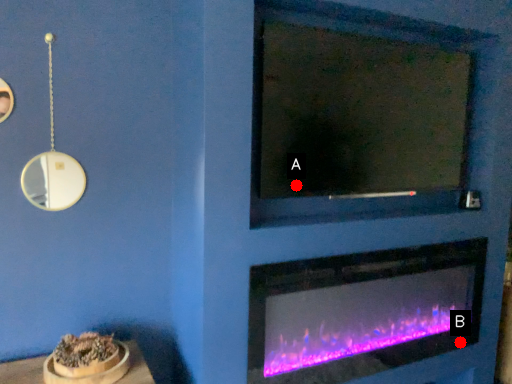
Question: Two points are circled on the image, labeled by A and B beside each circle. Which point appears closest to the camera in this image?

Choices:
 (A) A is closer
 (B) B is closer

Answer: (A)